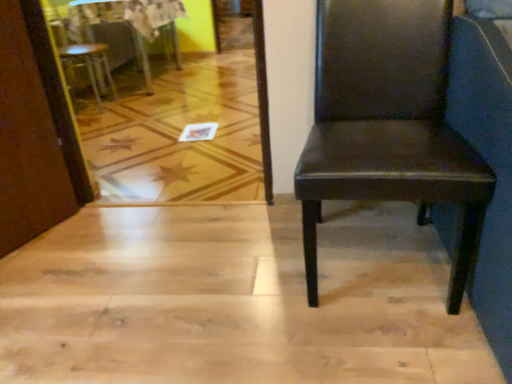
Question: Does matte brown leather chair at right, acting as the 1th chair starting from the right, have a smaller size compared to matte brown chair at upper left, arranged as the second chair when viewed from the front?

Choices:
 (A) yes
 (B) no

Answer: (B)

Question: Is matte brown leather chair at right, acting as the 1th chair starting from the right, not within matte brown chair at upper left, positioned as the second chair in bottom-to-top order?

Choices:
 (A) yes
 (B) no

Answer: (A)

Question: Is matte brown chair at upper left, which appears as the 1th chair when viewed from the back, located within matte brown leather chair at right, placed as the 2th chair when sorted from top to bottom?

Choices:
 (A) no
 (B) yes

Answer: (A)

Question: Could you tell me if matte brown leather chair at right, placed as the 2th chair when sorted from top to bottom, is turned towards matte brown chair at upper left, arranged as the second chair when viewed from the front?

Choices:
 (A) no
 (B) yes

Answer: (A)

Question: From a real-world perspective, does matte brown leather chair at right, placed as the 2th chair when sorted from top to bottom, sit lower than matte brown chair at upper left, the 1th chair viewed from the left?

Choices:
 (A) no
 (B) yes

Answer: (A)

Question: In terms of size, does matte brown leather chair at right, acting as the 1th chair starting from the right, appear bigger or smaller than matte brown chair at upper left, marked as the first chair in a top-to-bottom arrangement?

Choices:
 (A) small
 (B) big

Answer: (B)

Question: From a real-world perspective, is matte brown leather chair at right, the 2th chair from the left, above or below matte brown chair at upper left, the 1th chair viewed from the left?

Choices:
 (A) below
 (B) above

Answer: (B)

Question: In the image, is matte brown leather chair at right, placed as the 1th chair when sorted from bottom to top, positioned in front of or behind matte brown chair at upper left, placed as the 2th chair when sorted from right to left?

Choices:
 (A) behind
 (B) front

Answer: (B)

Question: Choose the correct answer: Is matte brown leather chair at right, acting as the 1th chair starting from the right, inside matte brown chair at upper left, arranged as the second chair when viewed from the front, or outside it?

Choices:
 (A) inside
 (B) outside

Answer: (B)

Question: Is wooden table at upper left to the left or to the right of matte brown chair at upper left, which appears as the 1th chair when viewed from the back, in the image?

Choices:
 (A) left
 (B) right

Answer: (B)

Question: Is wooden table at upper left wider or thinner than matte brown chair at upper left, placed as the 2th chair when sorted from right to left?

Choices:
 (A) thin
 (B) wide

Answer: (B)

Question: Is point (72, 18) positioned closer to the camera than point (97, 59)?

Choices:
 (A) farther
 (B) closer

Answer: (B)

Question: From a real-world perspective, relative to matte brown chair at upper left, placed as the 2th chair when sorted from right to left, is wooden table at upper left vertically above or below?

Choices:
 (A) below
 (B) above

Answer: (A)

Question: From the image's perspective, relative to wooden table at upper left, is matte brown leather chair at right, acting as the 1th chair starting from the right, above or below?

Choices:
 (A) above
 (B) below

Answer: (B)

Question: Considering the positions of point (470, 162) and point (176, 34), is point (470, 162) closer or farther from the camera than point (176, 34)?

Choices:
 (A) closer
 (B) farther

Answer: (A)